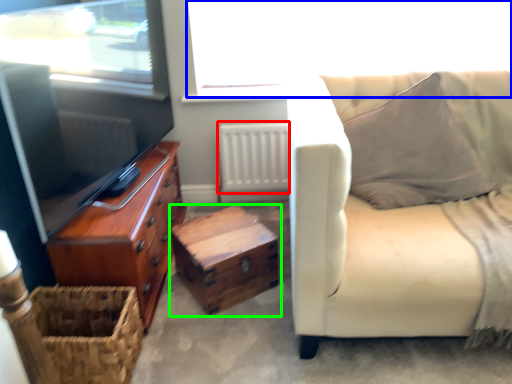
Question: Considering the real-world distances, which object is farthest from radiator (highlighted by a red box)? window screen (highlighted by a blue box) or table (highlighted by a green box)?

Choices:
 (A) window screen
 (B) table

Answer: (B)